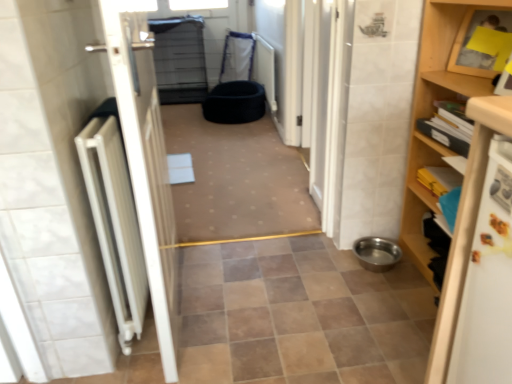
Find the location of a particular element. This screenshot has height=384, width=512. vacant space to the right of white metallic radiator at left is located at coordinates (251, 306).